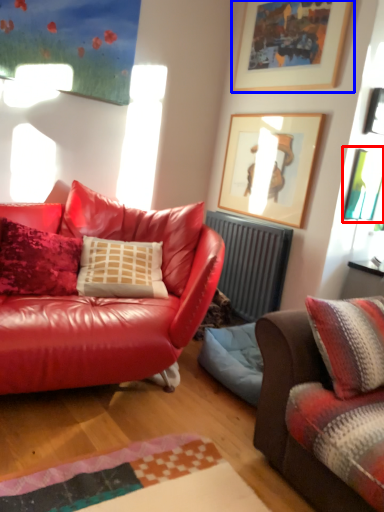
Question: Which object appears farthest to the camera in this image, picture frame (highlighted by a red box) or picture frame (highlighted by a blue box)?

Choices:
 (A) picture frame
 (B) picture frame

Answer: (A)